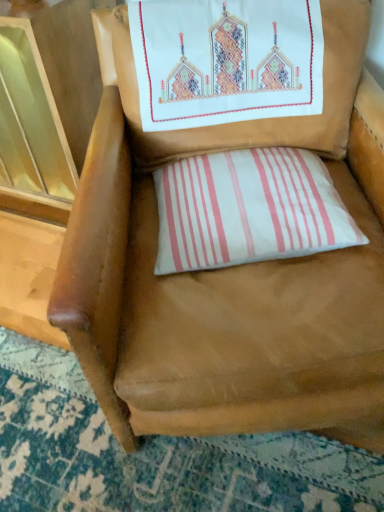
Describe the element at coordinates (248, 210) in the screenshot. I see `whitewith pink stripespillow at center` at that location.

This screenshot has width=384, height=512. I want to click on whitewith pink stripespillow at center, so click(x=248, y=210).

Identify the location of whitewith pink stripespillow at center. This screenshot has height=512, width=384. (248, 210).